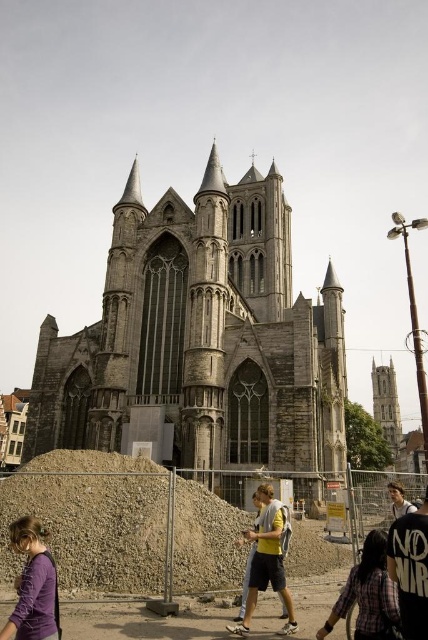
You are standing at the entrance of the church and want to reach the gravel pile at center. According to the coordinates provided, in which direction should you move from your current position to reach it?

The gravel pile at center is located at coordinates point (92, 520). Since the entrance is presumably at the front of the church, moving towards the center area would involve heading forward and slightly to the right based on the coordinate system where 0.0 is the bottom left corner and 1.0 is the top right corner.

You are a visitor standing at the entrance of the Gothic church and notice the gravelly dirt mound at lower center and the light brown hair at center. Which object is positioned to the left when facing the church?

The gravelly dirt mound at lower center is to the left of the light brown hair at center when facing the church.

In the scene shown: Based on the scene described, which object is positioned to the right when comparing the gravel pile at center and the gravelly dirt mound at lower center?

The gravel pile at center is to the right of the gravelly dirt mound at lower center.